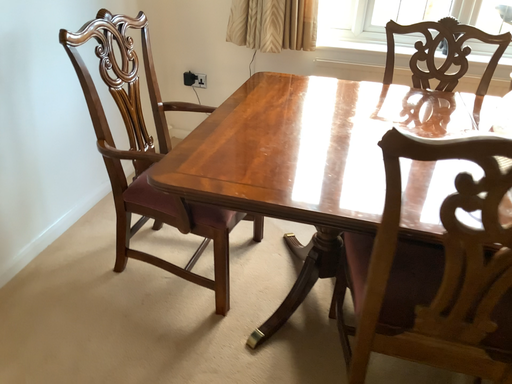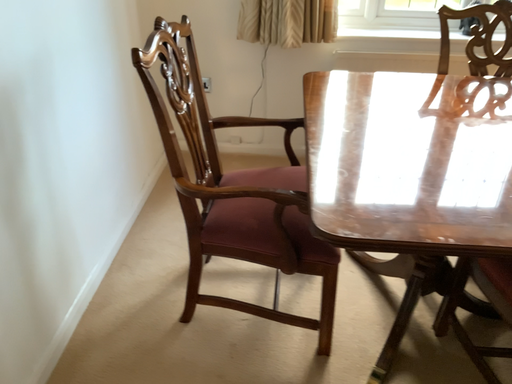
Question: Which way did the camera rotate in the video?

Choices:
 (A) rotated left
 (B) rotated right

Answer: (B)